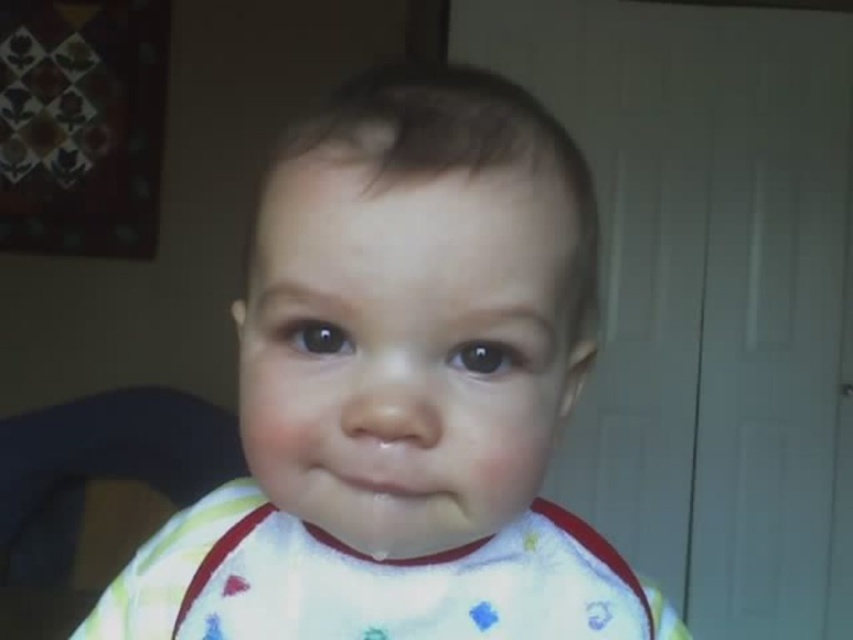
In the scene shown: Does white soft bib at center appear under dark gray fabric feeding chair at left?

No, white soft bib at center is not below dark gray fabric feeding chair at left.

Is point (440, 248) farther from camera compared to point (155, 484)?

No.

I want to click on white soft bib at center, so click(x=403, y=390).

Between white fabric bib at center and dark gray fabric feeding chair at left, which one has less height?

white fabric bib at center is shorter.

Is white fabric bib at center to the left of dark gray fabric feeding chair at left from the viewer's perspective?

In fact, white fabric bib at center is to the right of dark gray fabric feeding chair at left.

Which is behind, point (436, 556) or point (184, 484)?

Point (184, 484)

Identify the location of white fabric bib at center. The image size is (853, 640). (415, 586).

Which is in front, point (303, 195) or point (363, 628)?

Point (303, 195)

Does white soft bib at center have a larger size compared to white fabric bib at center?

Correct, white soft bib at center is larger in size than white fabric bib at center.

Identify the location of white soft bib at center. Image resolution: width=853 pixels, height=640 pixels. (403, 390).

This screenshot has height=640, width=853. What are the coordinates of `white soft bib at center` in the screenshot? It's located at (403, 390).